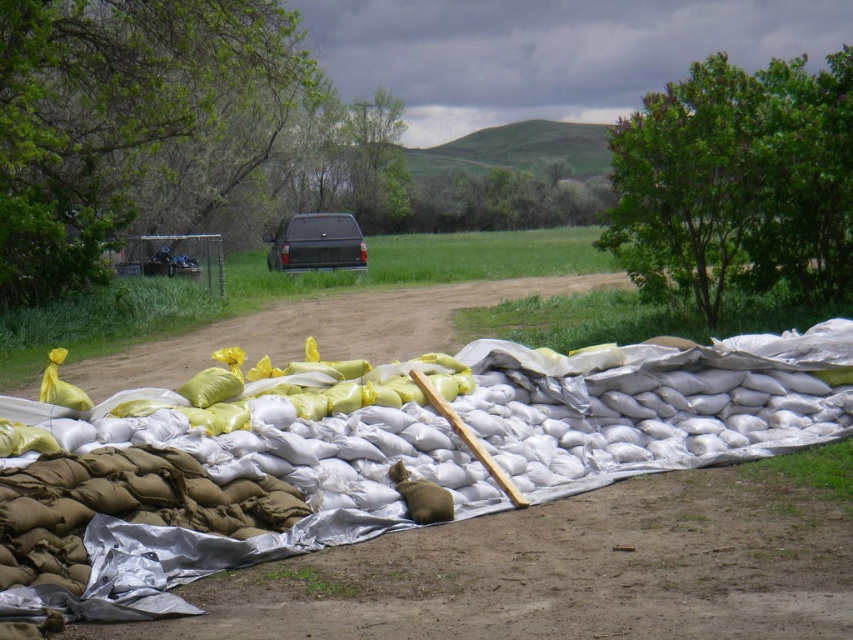
Question: Does white sandbags at center appear over matte black truck at center?

Choices:
 (A) no
 (B) yes

Answer: (A)

Question: Is white sandbags at center bigger than matte black truck at center?

Choices:
 (A) no
 (B) yes

Answer: (A)

Question: Is white sandbags at center smaller than matte black truck at center?

Choices:
 (A) no
 (B) yes

Answer: (B)

Question: Which of the following is the closest to the observer?

Choices:
 (A) white sandbags at center
 (B) matte black truck at center

Answer: (A)